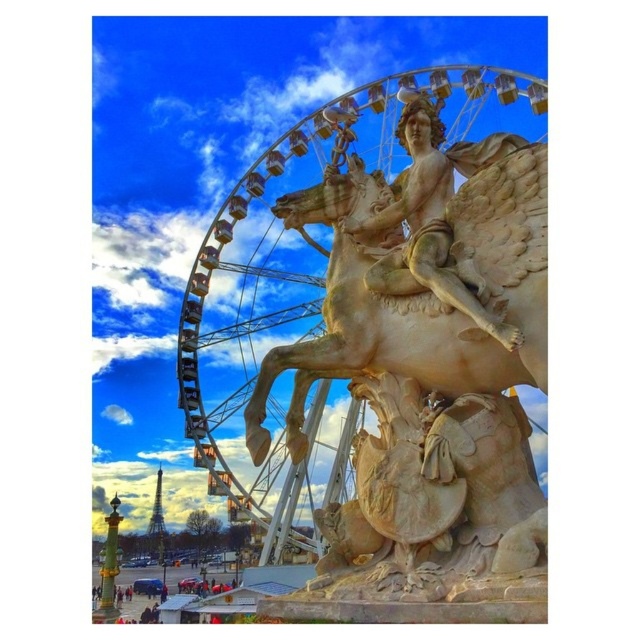
Question: Does metallic ferris wheel at center have a greater width compared to polished stone statue at center?

Choices:
 (A) yes
 (B) no

Answer: (A)

Question: Does metallic ferris wheel at center have a greater width compared to polished stone statue at center?

Choices:
 (A) yes
 (B) no

Answer: (A)

Question: Can you confirm if metallic ferris wheel at center is positioned to the left of polished stone statue at center?

Choices:
 (A) yes
 (B) no

Answer: (B)